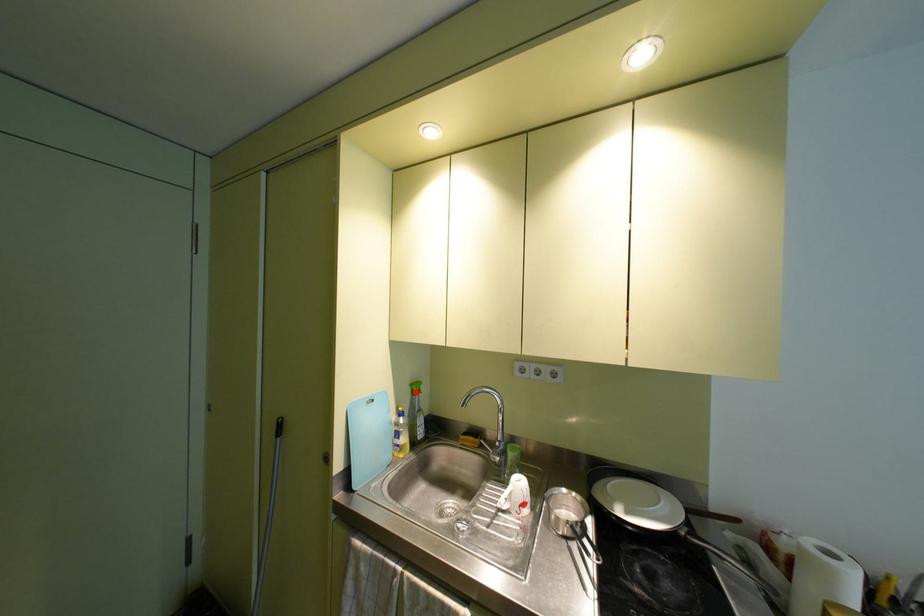
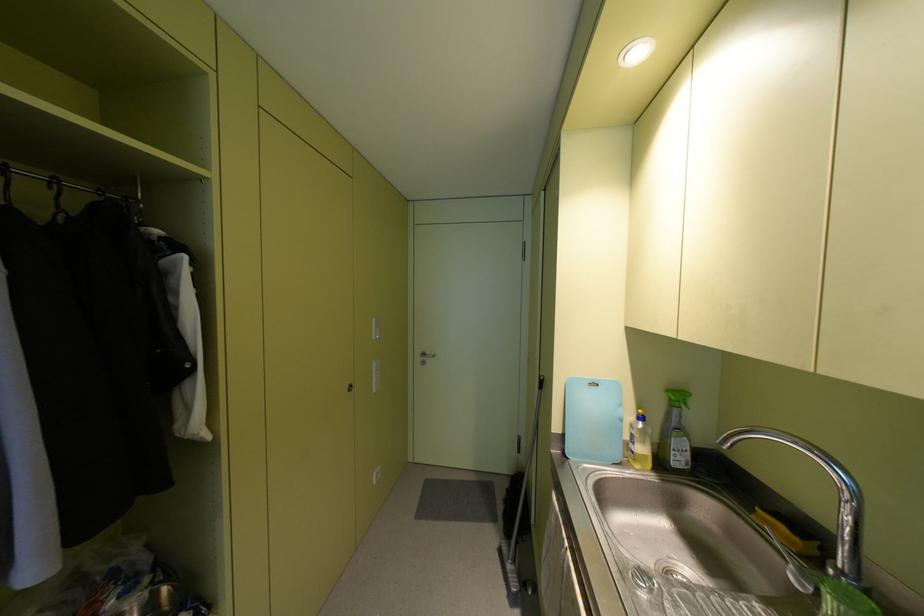
Question: I am providing you with two images of the same scene from different viewpoints. Image1 has a red point marked. In image2, the corresponding 3D location appears at what relative position? Reply with the corresponding letter.

Choices:
 (A) Closer
 (B) Farther

Answer: (A)